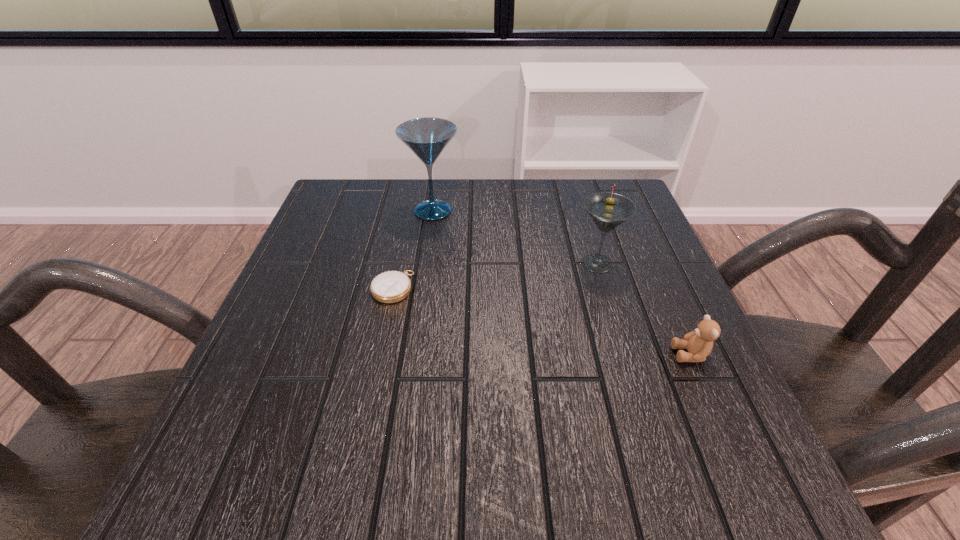
Where is `free region at the far right corner`? free region at the far right corner is located at coordinates (574, 198).

Locate an element on the screen. This screenshot has height=540, width=960. free space at the near right corner is located at coordinates (717, 503).

Where is `free space that is in between the second tallest object and the tallest object`? This screenshot has width=960, height=540. free space that is in between the second tallest object and the tallest object is located at coordinates 515,237.

This screenshot has height=540, width=960. In order to click on free spot between the shortest object and the shorter martini in this screenshot , I will do `click(494, 275)`.

This screenshot has height=540, width=960. Find the location of `vacant region between the taller martini and the shorter martini`. vacant region between the taller martini and the shorter martini is located at coordinates (515, 237).

Where is `unoccupied position between the shortest object and the third shortest object`? unoccupied position between the shortest object and the third shortest object is located at coordinates (494, 275).

You are a GUI agent. You are given a task and a screenshot of the screen. Output one action in this format:
    pyautogui.click(x=<x>, y=<y>)
    Task: Click on the vacant space in between the shortest object and the tallest object
    
    Given the screenshot: What is the action you would take?
    pos(413,249)

Locate an element on the screen. free space between the right martini and the tallest object is located at coordinates (515, 237).

The image size is (960, 540). In order to click on vacant area that lies between the shorter martini and the compass in this screenshot , I will do `click(494, 275)`.

Find the location of a particular element. This screenshot has width=960, height=540. free area in between the shorter martini and the left martini is located at coordinates (515, 237).